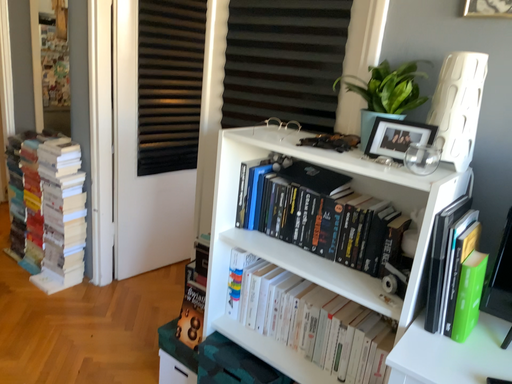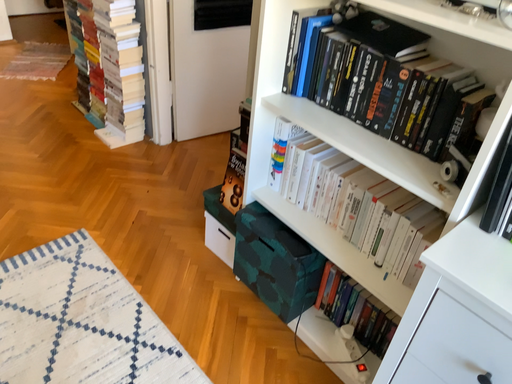
Question: Which way did the camera rotate in the video?

Choices:
 (A) rotated downward
 (B) rotated upward

Answer: (A)